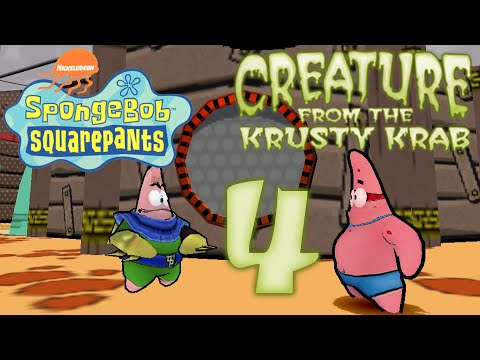
This screenshot has width=480, height=360. What are the coordinates of `brown steps` in the screenshot? It's located at (77, 304), (55, 281), (55, 251), (444, 285).